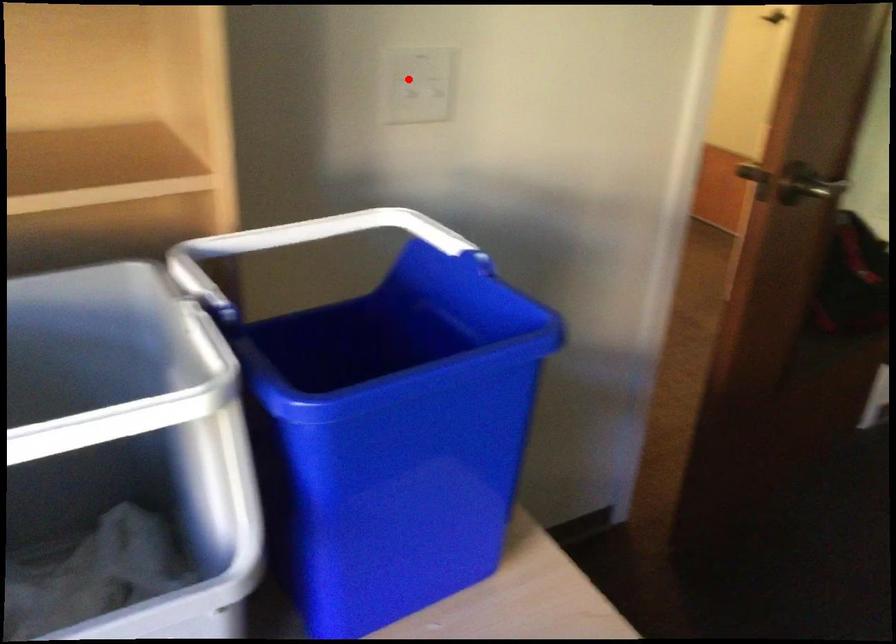
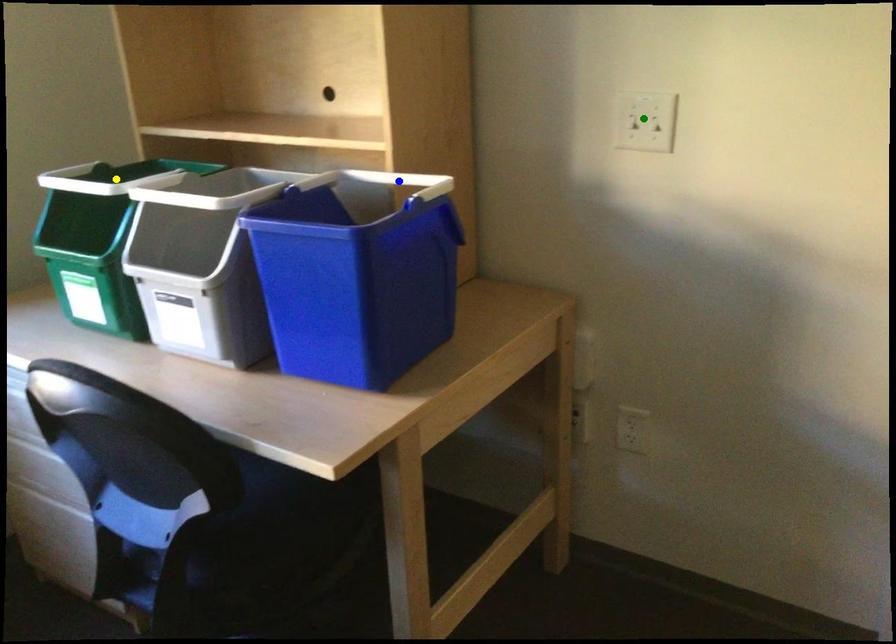
Question: I am providing you with two images of the same scene from different viewpoints. A red point is marked on the first image. You are given multiple points on the second image. Which point in image 2 is actually the same real-world point as the red point in image 1?

Choices:
 (A) blue point
 (B) green point
 (C) yellow point

Answer: (B)